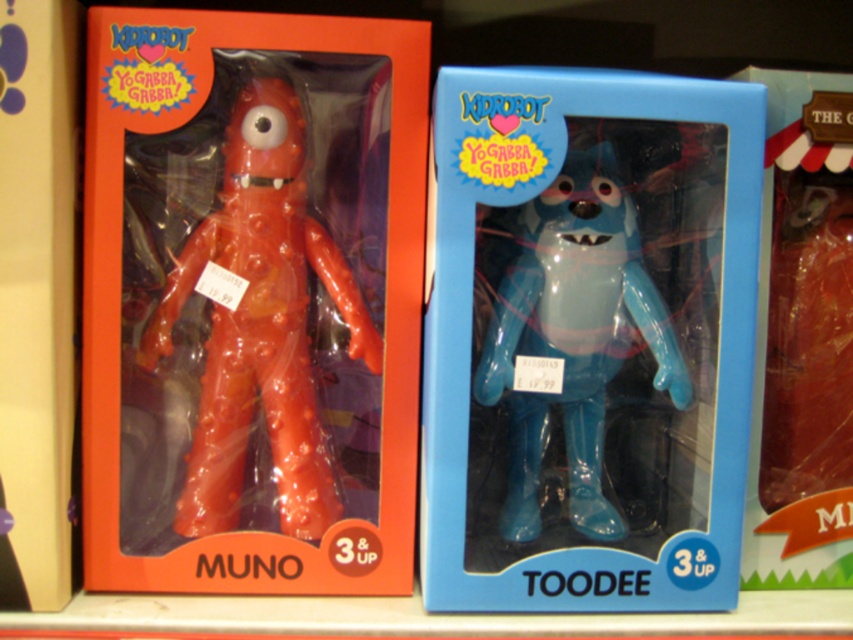
Is rubbery red figure at center below glossy plastic bear at center?

No, rubbery red figure at center is not below glossy plastic bear at center.

Does rubbery red figure at center appear on the left side of glossy plastic bear at center?

Indeed, rubbery red figure at center is positioned on the left side of glossy plastic bear at center.

Is point (209, 508) more distant than point (572, 236)?

Yes, point (209, 508) is farther from viewer.

The image size is (853, 640). I want to click on rubbery red figure at center, so click(260, 324).

Is blue glossy vinyl figure at center positioned in front of rubbery red figure at center?

Yes, blue glossy vinyl figure at center is in front of rubbery red figure at center.

Who is shorter, blue glossy vinyl figure at center or rubbery red figure at center?

rubbery red figure at center is shorter.

Which is behind, point (585, 72) or point (306, 449)?

Point (306, 449)

This screenshot has width=853, height=640. In order to click on blue glossy vinyl figure at center in this screenshot , I will do `click(587, 339)`.

Which is more to the left, blue glossy vinyl figure at center or glossy plastic bear at center?

From the viewer's perspective, blue glossy vinyl figure at center appears more on the left side.

Can you confirm if blue glossy vinyl figure at center is shorter than glossy plastic bear at center?

No, blue glossy vinyl figure at center is not shorter than glossy plastic bear at center.

What do you see at coordinates (587, 339) in the screenshot?
I see `blue glossy vinyl figure at center` at bounding box center [587, 339].

Find the location of a particular element. blue glossy vinyl figure at center is located at coordinates (587, 339).